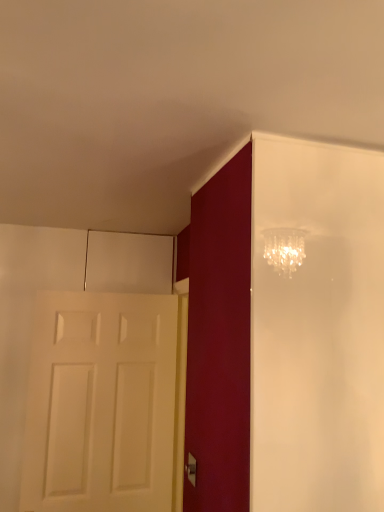
The width and height of the screenshot is (384, 512). What do you see at coordinates (191, 469) in the screenshot? I see `silver metallic door handle at lower center` at bounding box center [191, 469].

At what (x,y) coordinates should I click in order to perform the action: click on silver metallic door handle at lower center. Please return your answer as a coordinate pair (x, y). The image size is (384, 512). Looking at the image, I should click on (191, 469).

What do you see at coordinates (101, 403) in the screenshot? I see `white matte door at left` at bounding box center [101, 403].

I want to click on white matte door at left, so click(x=101, y=403).

This screenshot has width=384, height=512. Find the location of `silver metallic door handle at lower center`. silver metallic door handle at lower center is located at coordinates (191, 469).

Based on their positions, is white matte door at left located to the left or right of silver metallic door handle at lower center?

white matte door at left is positioned on silver metallic door handle at lower center's left side.

Is white matte door at left further to camera compared to silver metallic door handle at lower center?

Yes, white matte door at left is further from the viewer.

Is point (49, 417) in front of point (188, 464)?

No, it is behind (188, 464).

From the image's perspective, relative to silver metallic door handle at lower center, is white matte door at left above or below?

Based on their image positions, white matte door at left is located above silver metallic door handle at lower center.

Consider the image. From a real-world perspective, is white matte door at left over silver metallic door handle at lower center?

Yes, from a real-world perspective, white matte door at left is on top of silver metallic door handle at lower center.

Considering the sizes of objects white matte door at left and silver metallic door handle at lower center in the image provided, who is wider, white matte door at left or silver metallic door handle at lower center?

Wider between the two is white matte door at left.

Who is taller, white matte door at left or silver metallic door handle at lower center?

white matte door at left is taller.

In terms of size, does white matte door at left appear bigger or smaller than silver metallic door handle at lower center?

Considering their sizes, white matte door at left takes up more space than silver metallic door handle at lower center.

Would you say white matte door at left contains silver metallic door handle at lower center?

Actually, silver metallic door handle at lower center is outside white matte door at left.

Looking at this image, is white matte door at left in contact with silver metallic door handle at lower center?

No, white matte door at left is not next to silver metallic door handle at lower center.

Is white matte door at left positioned with its back to silver metallic door handle at lower center?

No, white matte door at left is not facing away from silver metallic door handle at lower center.

I want to click on door located above the silver metallic door handle at lower center (from the image's perspective), so click(101, 403).

Would you say silver metallic door handle at lower center is to the left or to the right of white matte door at left in the picture?

From the image, it's evident that silver metallic door handle at lower center is to the right of white matte door at left.

Is silver metallic door handle at lower center closer to camera compared to white matte door at left?

Yes, the depth of silver metallic door handle at lower center is less than that of white matte door at left.

Is point (188, 459) more distant than point (127, 435)?

No, it is in front of (127, 435).

From the image's perspective, which is below, silver metallic door handle at lower center or white matte door at left?

From the image's view, silver metallic door handle at lower center is below.

From a real-world perspective, who is located higher, silver metallic door handle at lower center or white matte door at left?

white matte door at left.

Can you confirm if silver metallic door handle at lower center is wider than white matte door at left?

Incorrect, the width of silver metallic door handle at lower center does not surpass that of white matte door at left.

From their relative heights in the image, would you say silver metallic door handle at lower center is taller or shorter than white matte door at left?

silver metallic door handle at lower center is shorter than white matte door at left.

Which of these two, silver metallic door handle at lower center or white matte door at left, is smaller?

With smaller size is silver metallic door handle at lower center.

In the scene shown: Would you say white matte door at left is part of silver metallic door handle at lower center's contents?

Definitely not — white matte door at left is not inside silver metallic door handle at lower center.

Does silver metallic door handle at lower center touch white matte door at left?

silver metallic door handle at lower center and white matte door at left are not in contact.

In the scene shown: Is silver metallic door handle at lower center oriented away from white matte door at left?

No, silver metallic door handle at lower center is not facing away from white matte door at left.

The height and width of the screenshot is (512, 384). Identify the location of door to the left of silver metallic door handle at lower center. (101, 403).

You are a GUI agent. You are given a task and a screenshot of the screen. Output one action in this format:
    pyautogui.click(x=<x>, y=<y>)
    Task: Click on the door handle that appears on the right of white matte door at left
    
    Given the screenshot: What is the action you would take?
    pyautogui.click(x=191, y=469)

Find the location of a particular element. The width and height of the screenshot is (384, 512). door handle below the white matte door at left (from the image's perspective) is located at coordinates pos(191,469).